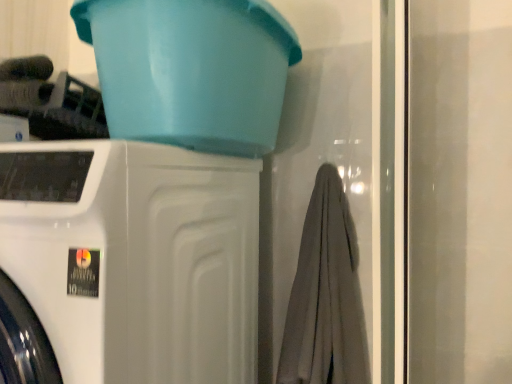
The image size is (512, 384). Identify the location of matte plastic basin at upper center. (191, 70).

What do you see at coordinates (127, 264) in the screenshot? I see `white glossy washing machine at left` at bounding box center [127, 264].

Where is `matte plastic basin at upper center`? This screenshot has width=512, height=384. matte plastic basin at upper center is located at coordinates [x=191, y=70].

How many degrees apart are the facing directions of gray cotton bath towel at center and matte plastic basin at upper center?

The angular difference between gray cotton bath towel at center and matte plastic basin at upper center is 0.169 degrees.

Is gray cotton bath towel at center oriented towards matte plastic basin at upper center?

No, gray cotton bath towel at center is not oriented towards matte plastic basin at upper center.

Is gray cotton bath towel at center further to camera compared to matte plastic basin at upper center?

Yes.

Consider the image. Is gray cotton bath towel at center looking in the opposite direction of white glossy washing machine at left?

That's not correct — gray cotton bath towel at center is not looking away from white glossy washing machine at left.

In terms of height, does gray cotton bath towel at center look taller or shorter compared to white glossy washing machine at left?

gray cotton bath towel at center is shorter than white glossy washing machine at left.

From a real-world perspective, who is located higher, gray cotton bath towel at center or white glossy washing machine at left?

In real-world perspective, gray cotton bath towel at center is above.

Considering the relative positions of gray cotton bath towel at center and white glossy washing machine at left in the image provided, is gray cotton bath towel at center to the right of white glossy washing machine at left from the viewer's perspective?

Correct, you'll find gray cotton bath towel at center to the right of white glossy washing machine at left.

Is point (264, 41) positioned after point (349, 374)?

No, it is in front of (349, 374).

Between matte plastic basin at upper center and gray cotton bath towel at center, which one has smaller size?

Smaller between the two is gray cotton bath towel at center.

Considering their positions, is matte plastic basin at upper center located in front of or behind gray cotton bath towel at center?

matte plastic basin at upper center is in front of gray cotton bath towel at center.

At what (x,y) coordinates should I click in order to perform the action: click on basin on the left of gray cotton bath towel at center. Please return your answer as a coordinate pair (x, y). Image resolution: width=512 pixels, height=384 pixels. Looking at the image, I should click on (191, 70).

Is white glossy washing machine at left wider than matte plastic basin at upper center?

Yes, white glossy washing machine at left is wider than matte plastic basin at upper center.

Is white glossy washing machine at left outside of matte plastic basin at upper center?

Yes, white glossy washing machine at left is located beyond the bounds of matte plastic basin at upper center.

Considering their positions, is white glossy washing machine at left located in front of or behind matte plastic basin at upper center?

Clearly, white glossy washing machine at left is in front of matte plastic basin at upper center.

Which is more to the left, white glossy washing machine at left or matte plastic basin at upper center?

white glossy washing machine at left.

Is matte plastic basin at upper center looking in the opposite direction of white glossy washing machine at left?

No, matte plastic basin at upper center is not facing the opposite direction of white glossy washing machine at left.

From the image's perspective, which is below, matte plastic basin at upper center or white glossy washing machine at left?

white glossy washing machine at left.

This screenshot has height=384, width=512. Find the location of `basin that is above the white glossy washing machine at left (from the image's perspective)`. basin that is above the white glossy washing machine at left (from the image's perspective) is located at coordinates (191, 70).

Which of these two, matte plastic basin at upper center or white glossy washing machine at left, is thinner?

matte plastic basin at upper center is thinner.

In terms of width, does white glossy washing machine at left look wider or thinner when compared to gray cotton bath towel at center?

Clearly, white glossy washing machine at left has more width compared to gray cotton bath towel at center.

Locate an element on the screen. Image resolution: width=512 pixels, height=384 pixels. bath towel above the white glossy washing machine at left (from the image's perspective) is located at coordinates (326, 295).

In the scene shown: How many degrees apart are the facing directions of white glossy washing machine at left and gray cotton bath towel at center?

The angular difference between white glossy washing machine at left and gray cotton bath towel at center is 0.169 degrees.

Would you say white glossy washing machine at left is a long distance from gray cotton bath towel at center?

white glossy washing machine at left is near gray cotton bath towel at center, not far away.

Image resolution: width=512 pixels, height=384 pixels. In order to click on bath towel below the matte plastic basin at upper center (from the image's perspective) in this screenshot , I will do `click(326, 295)`.

Find the location of a particular element. The image size is (512, 384). bath towel above the white glossy washing machine at left (from the image's perspective) is located at coordinates (326, 295).

Based on their spatial positions, is matte plastic basin at upper center or white glossy washing machine at left further from gray cotton bath towel at center?

Based on the image, matte plastic basin at upper center appears to be further to gray cotton bath towel at center.

Estimate the real-world distances between objects in this image. Which object is further from matte plastic basin at upper center, gray cotton bath towel at center or white glossy washing machine at left?

Among the two, gray cotton bath towel at center is located further to matte plastic basin at upper center.

From the image, which object appears to be nearer to white glossy washing machine at left, gray cotton bath towel at center or matte plastic basin at upper center?

Based on the image, matte plastic basin at upper center appears to be nearer to white glossy washing machine at left.

Based on the photo, which object lies nearer to the anchor point white glossy washing machine at left, matte plastic basin at upper center or gray cotton bath towel at center?

matte plastic basin at upper center lies closer to white glossy washing machine at left than the other object.

Based on their spatial positions, is white glossy washing machine at left or matte plastic basin at upper center closer to gray cotton bath towel at center?

white glossy washing machine at left.

When comparing their distances from matte plastic basin at upper center, does white glossy washing machine at left or gray cotton bath towel at center seem further?

gray cotton bath towel at center.

Find the location of `bath towel between matte plastic basin at upper center and white glossy washing machine at left in the up-down direction`. bath towel between matte plastic basin at upper center and white glossy washing machine at left in the up-down direction is located at coordinates (326, 295).